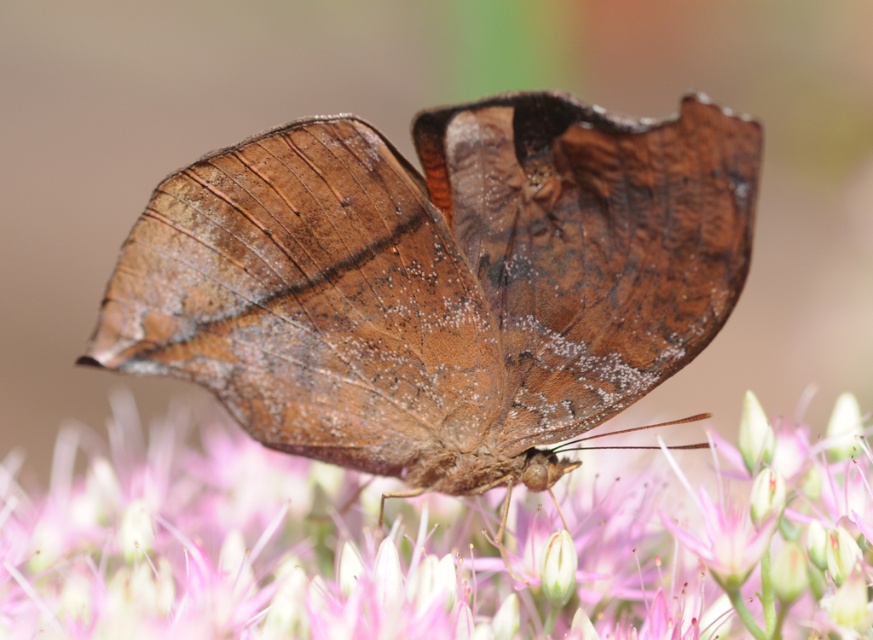
Question: Is brown matte butterfly at center below pink fuzzy flower at center?

Choices:
 (A) yes
 (B) no

Answer: (B)

Question: Which point is closer to the camera taking this photo?

Choices:
 (A) (469, 545)
 (B) (345, 173)

Answer: (B)

Question: Which point is farther from the camera taking this photo?

Choices:
 (A) (669, 227)
 (B) (634, 490)

Answer: (B)

Question: Is brown matte butterfly at center in front of pink fuzzy flower at center?

Choices:
 (A) no
 (B) yes

Answer: (A)

Question: Does brown matte butterfly at center appear on the right side of pink fuzzy flower at center?

Choices:
 (A) yes
 (B) no

Answer: (A)